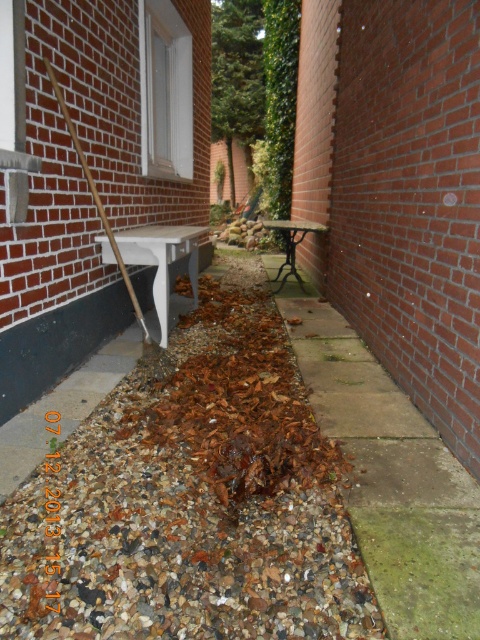
Question: Is brown leaf litter at center to the left of white glossy bench at left from the viewer's perspective?

Choices:
 (A) yes
 (B) no

Answer: (B)

Question: Which point is farther to the camera?

Choices:
 (A) (282, 264)
 (B) (157, 243)

Answer: (A)

Question: Which object is the closest to the white glossy bench at left?

Choices:
 (A) brown leaf litter at center
 (B) wooden bench at center

Answer: (A)

Question: Is brown leaf litter at center bigger than white glossy bench at left?

Choices:
 (A) yes
 (B) no

Answer: (A)

Question: Which point is closer to the camera taking this photo?

Choices:
 (A) (310, 225)
 (B) (143, 240)
 (C) (279, 444)

Answer: (C)

Question: Does brown leaf litter at center have a smaller size compared to white glossy bench at left?

Choices:
 (A) yes
 (B) no

Answer: (B)